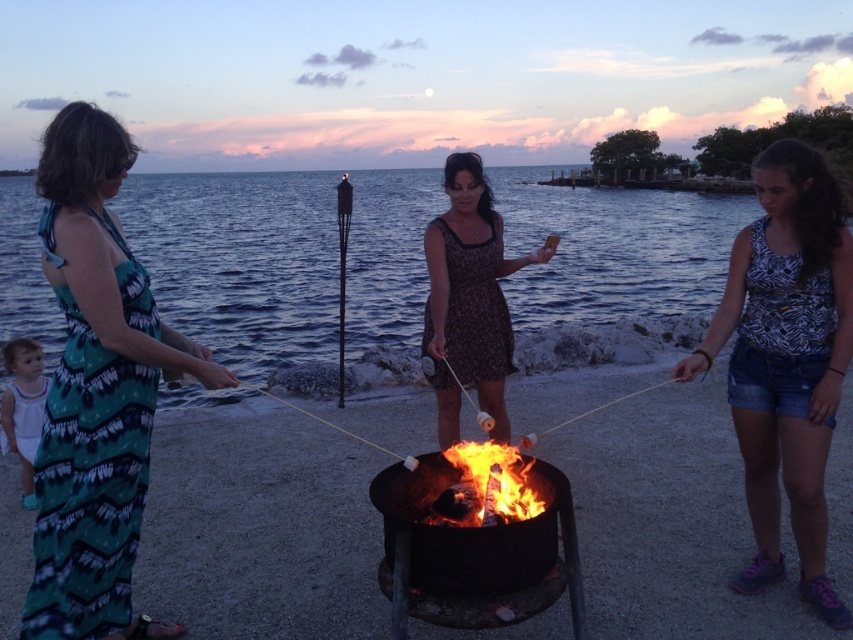
Can you confirm if denim shorts at right is positioned to the left of flaming wood at center?

No, denim shorts at right is not to the left of flaming wood at center.

Which is behind, point (767, 412) or point (444, 493)?

Positioned behind is point (767, 412).

Identify the location of denim shorts at right. (786, 362).

Is blue water at center closer to the viewer compared to white cotton dress at lower left?

Yes, it is in front of white cotton dress at lower left.

Between blue water at center and white cotton dress at lower left, which one appears on the left side from the viewer's perspective?

From the viewer's perspective, blue water at center appears more on the left side.

The width and height of the screenshot is (853, 640). In order to click on blue water at center in this screenshot , I will do [244, 268].

The width and height of the screenshot is (853, 640). In order to click on blue water at center in this screenshot , I will do `click(244, 268)`.

Does point (520, 522) come closer to viewer compared to point (505, 451)?

Yes, it is.

Which of these two, black metal fire pit at center or flaming wood at center, stands taller?

black metal fire pit at center is taller.

The height and width of the screenshot is (640, 853). In order to click on black metal fire pit at center in this screenshot , I will do `click(474, 552)`.

The width and height of the screenshot is (853, 640). Identify the location of black metal fire pit at center. (474, 552).